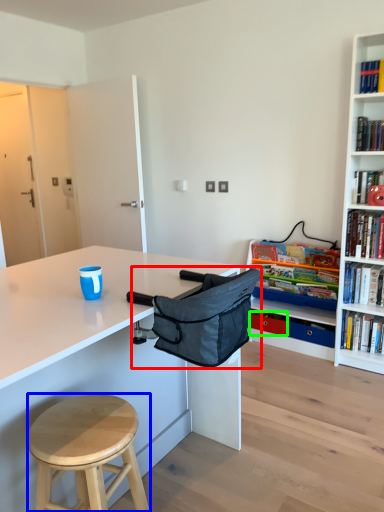
Question: Considering the real-world distances, which object is closest to folding chair (highlighted by a red box)? stool (highlighted by a blue box) or drawer (highlighted by a green box).

Choices:
 (A) stool
 (B) drawer

Answer: (A)